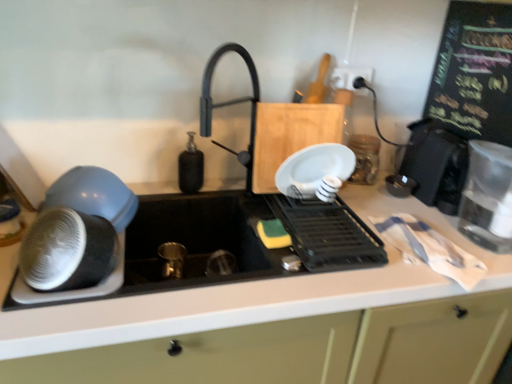
Question: From a real-world perspective, is white plastic electric outlet at upper right positioned above or below black plastic dish rack at center, arranged as the third appliance when viewed from the right?

Choices:
 (A) below
 (B) above

Answer: (B)

Question: Do you think white plastic electric outlet at upper right is within black plastic dish rack at center, arranged as the third appliance when viewed from the right, or outside of it?

Choices:
 (A) inside
 (B) outside

Answer: (B)

Question: Based on their relative distances, which object is farther from the clear glass jar at upper right, which appears as the 3th appliance when viewed from the left?

Choices:
 (A) black plastic dish rack at center, arranged as the third appliance when viewed from the right
 (B) black plastic toaster at right, the 4th appliance positioned from the left
 (C) black matte soap dispenser at center
 (D) white plastic electric outlet at upper right
 (E) matte blue bowl at left, the first kitchen appliance from the left

Answer: (E)

Question: Which object is positioned closest to the white plastic electric outlet at upper right?

Choices:
 (A) clear glass jar at upper right, placed as the second appliance when sorted from right to left
 (B) black matte soap dispenser at center
 (C) black plastic toaster at right, the 4th appliance positioned from the left
 (D) matte black bowl at left, which ranks as the 1th appliance in left-to-right order
 (E) clear glass water at right, acting as the first kitchen appliance starting from the right

Answer: (A)